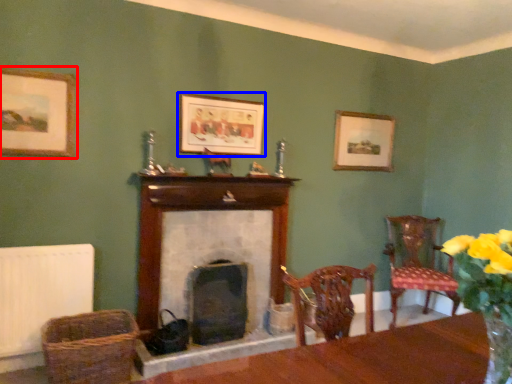
Question: Which object appears farthest to the camera in this image, picture frame (highlighted by a red box) or picture frame (highlighted by a blue box)?

Choices:
 (A) picture frame
 (B) picture frame

Answer: (B)